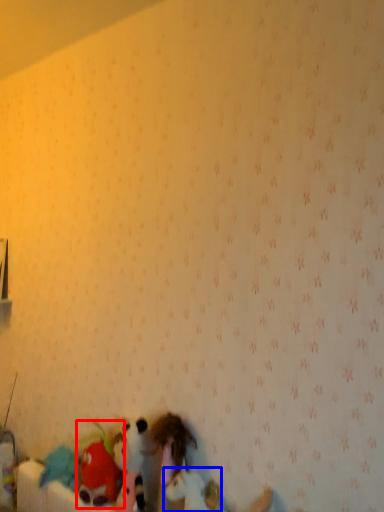
Question: Which point is further to the camera, toy (highlighted by a red box) or toy (highlighted by a blue box)?

Choices:
 (A) toy
 (B) toy

Answer: (A)